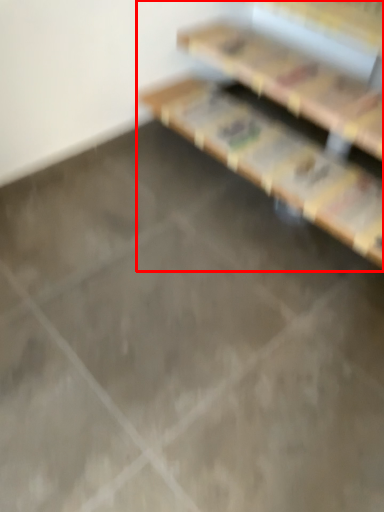
Question: In this image, where is furniture (annotated by the red box) located relative to shelf?

Choices:
 (A) left
 (B) right

Answer: (A)